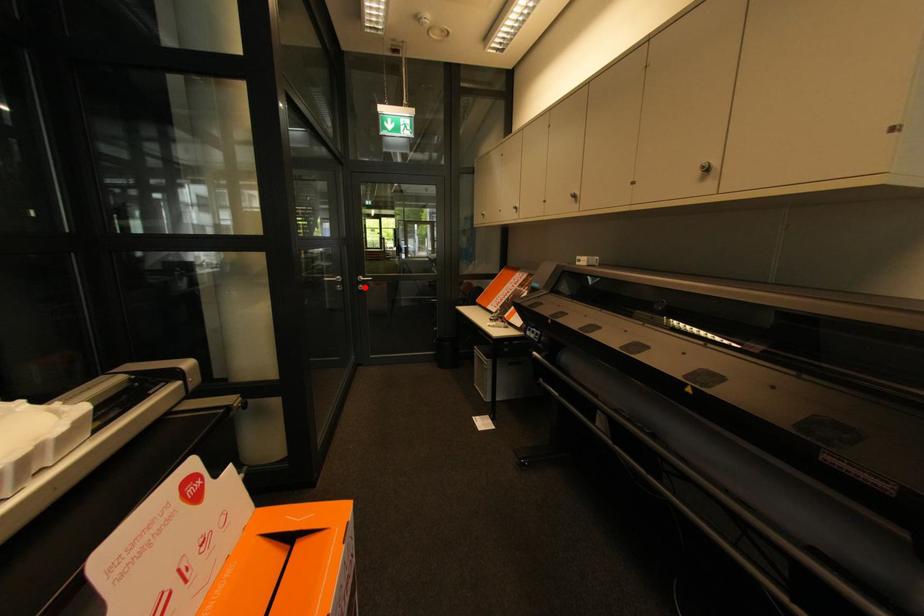
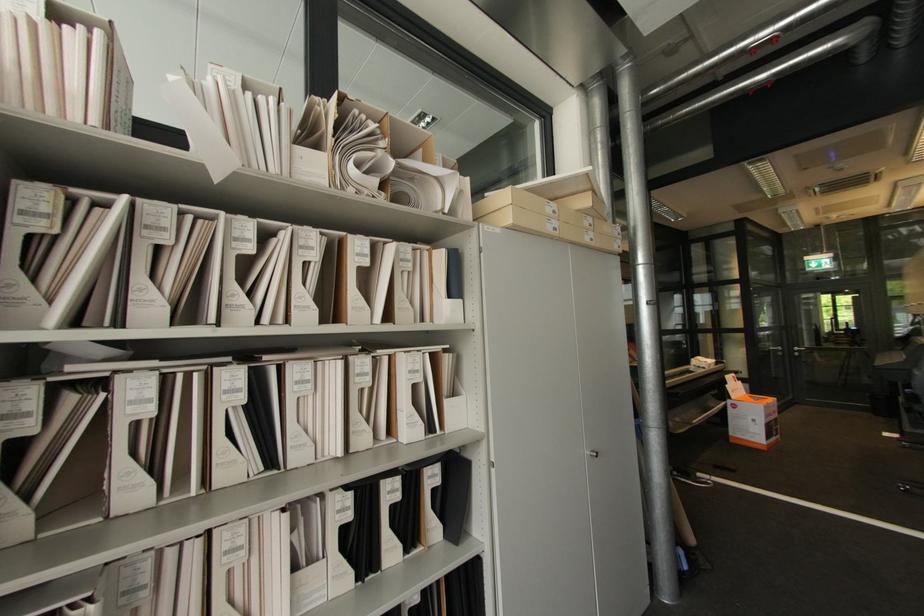
The point at the highlighted location is marked in the first image. Where is the corresponding point in the second image?

(800, 354)